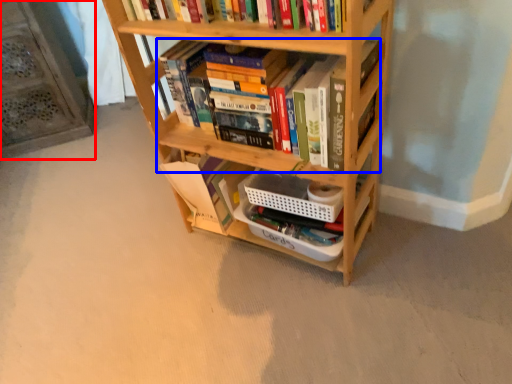
Question: Which of the following is the closest to the observer, shelf (highlighted by a red box) or book (highlighted by a blue box)?

Choices:
 (A) shelf
 (B) book

Answer: (B)